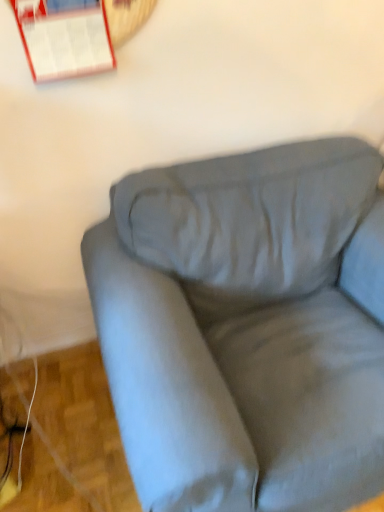
What do you see at coordinates (241, 330) in the screenshot? The image size is (384, 512). I see `satin gray couch at center` at bounding box center [241, 330].

Measure the distance between point (185,460) and camera.

A distance of 30.24 inches exists between point (185,460) and camera.

This screenshot has height=512, width=384. Identify the location of satin gray couch at center. (241, 330).

Identify the location of satin gray couch at center. (241, 330).